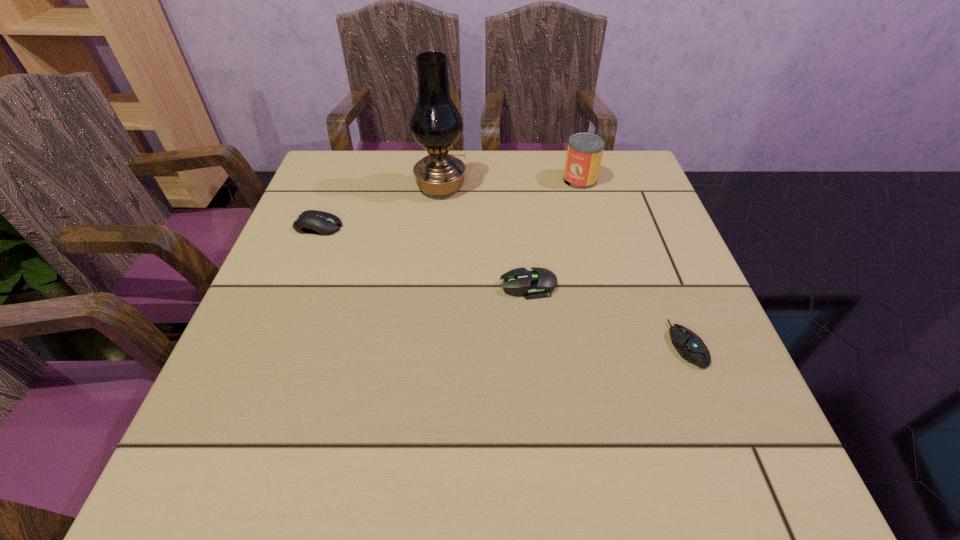
Where is `object positioned at the far right corner`? This screenshot has width=960, height=540. object positioned at the far right corner is located at coordinates (584, 153).

Where is `free location at the far edge`? The width and height of the screenshot is (960, 540). free location at the far edge is located at coordinates (526, 187).

Find the location of a particular element. The height and width of the screenshot is (540, 960). vacant space at the near edge of the desktop is located at coordinates (498, 476).

Where is `free region at the left edge of the desktop`? free region at the left edge of the desktop is located at coordinates (308, 282).

Image resolution: width=960 pixels, height=540 pixels. In order to click on blank space at the right edge of the desktop in this screenshot , I will do pyautogui.click(x=680, y=393).

Identify the location of vacant space at the far left corner of the desktop. The image size is (960, 540). (347, 150).

In order to click on free space at the far right corner in this screenshot , I will do `click(638, 196)`.

The image size is (960, 540). Find the location of `vacant space at the near right corner of the desktop`. vacant space at the near right corner of the desktop is located at coordinates (773, 484).

The width and height of the screenshot is (960, 540). Find the location of `blank region between the second tallest object and the leftmost object`. blank region between the second tallest object and the leftmost object is located at coordinates (449, 203).

The height and width of the screenshot is (540, 960). Identify the location of free space that is in between the third shortest object and the fourth object from right to left. (379, 207).